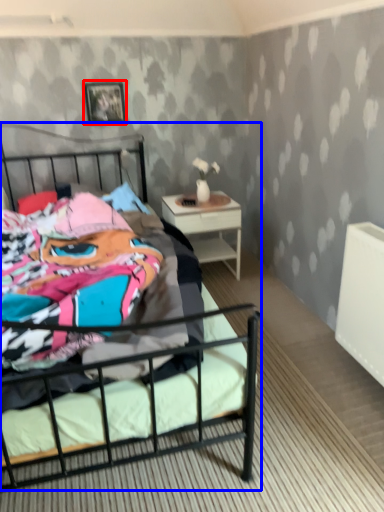
Question: Among these objects, which one is farthest to the camera, picture frame (highlighted by a red box) or bed (highlighted by a blue box)?

Choices:
 (A) picture frame
 (B) bed

Answer: (A)